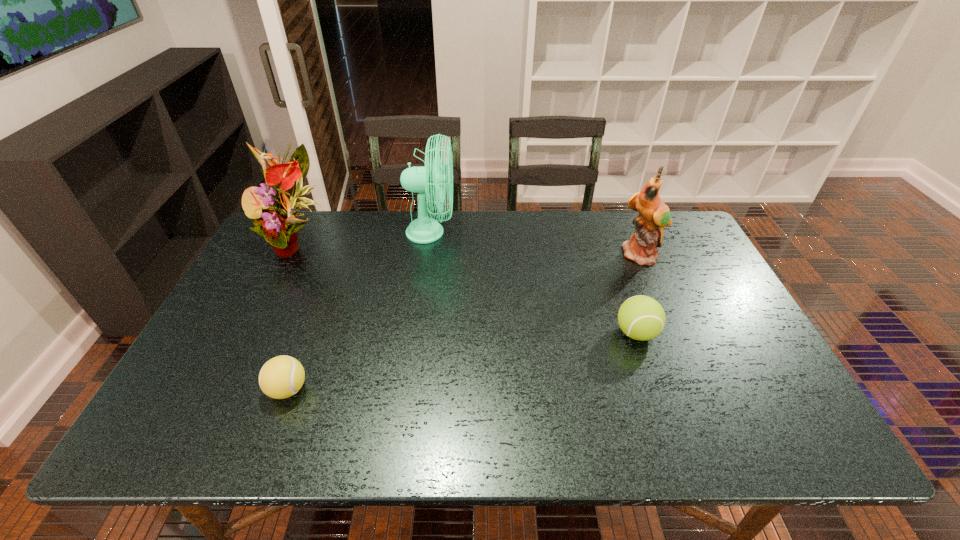
This screenshot has height=540, width=960. Identify the location of vacant space that's between the parrot and the taller tennis ball. (639, 294).

Find the location of a particular element. free spot between the nearest object and the right tennis ball is located at coordinates (462, 361).

Identify the location of free spot between the bouquet and the taller tennis ball. (468, 288).

This screenshot has height=540, width=960. What are the coordinates of `vacant area that lies between the parrot and the nearer tennis ball` in the screenshot? It's located at (465, 322).

Identify which object is the second nearest to the fan. Please provide its 2D coordinates. Your answer should be formatted as a tuple, i.e. [(x, y)], where the tuple contains the x and y coordinates of a point satisfying the conditions above.

[(281, 377)]

Locate an element on the screen. The height and width of the screenshot is (540, 960). the fourth closest object relative to the parrot is located at coordinates (281, 377).

At what (x,y) coordinates should I click in order to perform the action: click on free location that satisfies the following two spatial constraints: 1. in front of the third object from left to right to blow air; 2. on the front-facing side of the bouquet. Please return your answer as a coordinate pair (x, y). Image resolution: width=960 pixels, height=540 pixels. Looking at the image, I should click on (429, 244).

Find the location of a particular element. The width and height of the screenshot is (960, 540). vacant space that satisfies the following two spatial constraints: 1. in front of the third object from right to left to blow air; 2. on the back side of the right tennis ball is located at coordinates (417, 333).

The height and width of the screenshot is (540, 960). I want to click on vacant space that satisfies the following two spatial constraints: 1. on the front-facing side of the fourth farthest object; 2. on the right side of the bouquet, so click(x=255, y=333).

Image resolution: width=960 pixels, height=540 pixels. What are the coordinates of `free region that satisfies the following two spatial constraints: 1. in front of the third object from left to right to blow air; 2. on the front-facing side of the bouquet` in the screenshot? It's located at (429, 244).